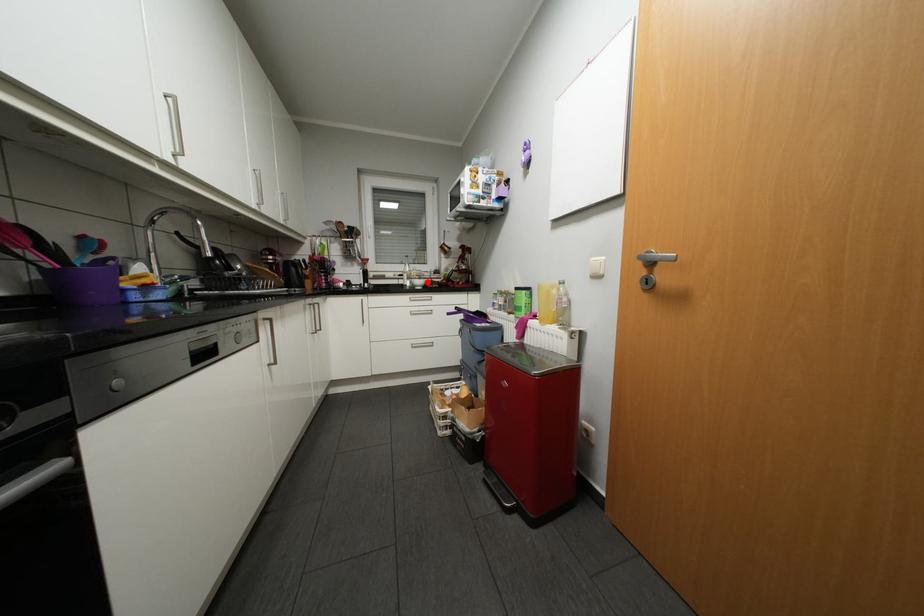
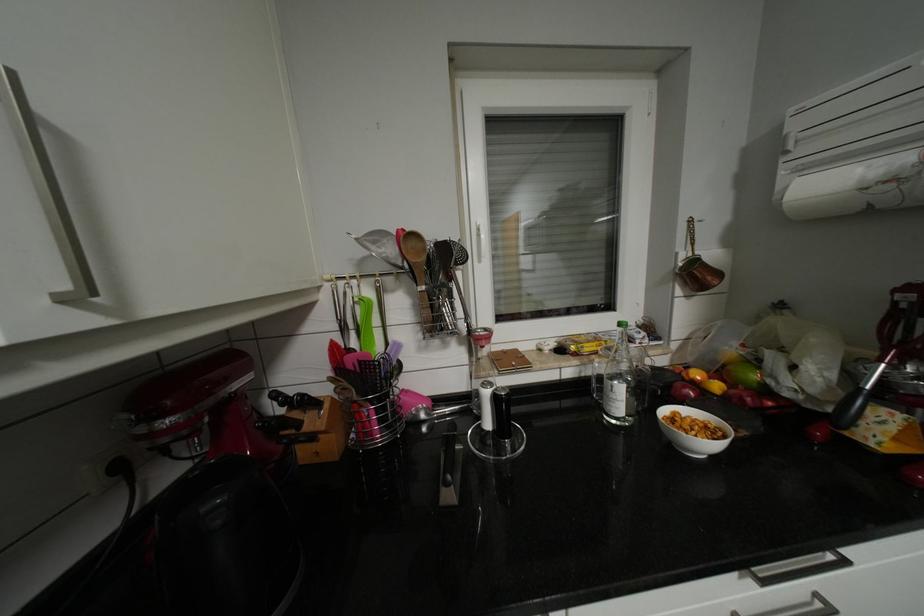
Where in the second image is the point corresponding to the highlighted location from the first image?

(703, 430)